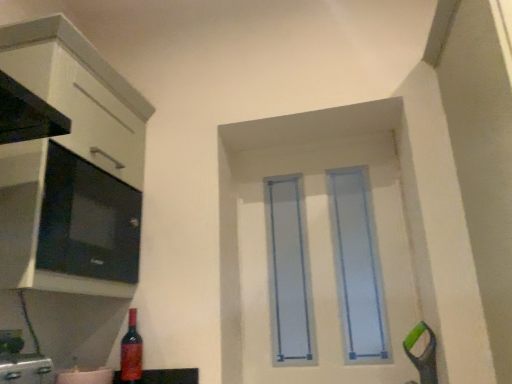
What do you see at coordinates (87, 220) in the screenshot? The image size is (512, 384). I see `matte black microwave at left` at bounding box center [87, 220].

This screenshot has height=384, width=512. Describe the element at coordinates (324, 263) in the screenshot. I see `light blue plastic door at center` at that location.

You are a GUI agent. You are given a task and a screenshot of the screen. Output one action in this format:
    pyautogui.click(x=<x>, y=<y>)
    Task: Click on the matte black microwave at left
    Image resolution: width=512 pixels, height=384 pixels.
    Given the screenshot: What is the action you would take?
    pyautogui.click(x=87, y=220)

Would you consider shiny red glass bottle at lower left to be distant from light blue plastic door at center?

Actually, shiny red glass bottle at lower left and light blue plastic door at center are a little close together.

From the picture: Can we say shiny red glass bottle at lower left lies outside light blue plastic door at center?

Yes, shiny red glass bottle at lower left is located beyond the bounds of light blue plastic door at center.

In the image, is shiny red glass bottle at lower left positioned in front of or behind light blue plastic door at center?

shiny red glass bottle at lower left is positioned closer to the viewer than light blue plastic door at center.

Could you tell me if shiny red glass bottle at lower left is facing light blue plastic door at center?

No, shiny red glass bottle at lower left is not oriented towards light blue plastic door at center.

Which object is closer to the camera, white glossy cabinet at left or light blue plastic door at center?

white glossy cabinet at left is more forward.

This screenshot has width=512, height=384. Identify the location of cabinetry lying above the light blue plastic door at center (from the image's perspective). (71, 168).

Is point (8, 156) positioned after point (370, 156)?

No.

From the image's perspective, does white glossy cabinet at left appear lower than light blue plastic door at center?

No.

Between matte black microwave at left and white glossy cabinet at left, which one has more height?

white glossy cabinet at left is taller.

Locate an element on the screen. This screenshot has width=512, height=384. appliance behind the white glossy cabinet at left is located at coordinates (87, 220).

Can we say matte black microwave at left lies outside white glossy cabinet at left?

Actually, matte black microwave at left is at least partially inside white glossy cabinet at left.

Considering the positions of objects white glossy cabinet at left and shiny red glass bottle at lower left in the image provided, who is in front, white glossy cabinet at left or shiny red glass bottle at lower left?

white glossy cabinet at left is in front.

From a real-world perspective, who is located lower, white glossy cabinet at left or shiny red glass bottle at lower left?

From a 3D spatial view, shiny red glass bottle at lower left is below.

Is white glossy cabinet at left spatially inside shiny red glass bottle at lower left, or outside of it?

white glossy cabinet at left lies outside shiny red glass bottle at lower left.

Is shiny red glass bottle at lower left at the back of white glossy cabinet at left?

white glossy cabinet at left does not have its back to shiny red glass bottle at lower left.

Is shiny red glass bottle at lower left taller or shorter than matte black microwave at left?

shiny red glass bottle at lower left is shorter than matte black microwave at left.

Is shiny red glass bottle at lower left to the left or to the right of matte black microwave at left in the image?

In the image, shiny red glass bottle at lower left appears on the right side of matte black microwave at left.

Is point (138, 379) closer to camera compared to point (135, 253)?

Yes.

Is the position of shiny red glass bottle at lower left more distant than that of matte black microwave at left?

That is True.

Between light blue plastic door at center and white glossy cabinet at left, which one has larger width?

With larger width is white glossy cabinet at left.

Is point (367, 159) behind point (96, 186)?

Yes.

Is light blue plastic door at center not close to white glossy cabinet at left?

That's not correct — light blue plastic door at center is a little close to white glossy cabinet at left.

Can you confirm if light blue plastic door at center is shorter than white glossy cabinet at left?

Incorrect, the height of light blue plastic door at center does not fall short of that of white glossy cabinet at left.

This screenshot has height=384, width=512. Identify the location of appliance that appears above the shiny red glass bottle at lower left (from the image's perspective). (87, 220).

Is matte black microwave at left not near shiny red glass bottle at lower left?

No, matte black microwave at left is not far away from shiny red glass bottle at lower left.

In terms of height, does matte black microwave at left look taller or shorter compared to shiny red glass bottle at lower left?

Clearly, matte black microwave at left is taller compared to shiny red glass bottle at lower left.

From the image's perspective, which one is positioned lower, matte black microwave at left or shiny red glass bottle at lower left?

shiny red glass bottle at lower left, from the image's perspective.

You are a GUI agent. You are given a task and a screenshot of the screen. Output one action in this format:
    pyautogui.click(x=<x>, y=<y>)
    Task: Click on the door above the shiny red glass bottle at lower left (from a real-world perspective)
    Image resolution: width=512 pixels, height=384 pixels.
    Given the screenshot: What is the action you would take?
    pyautogui.click(x=324, y=263)

Identify the location of door directly beneath the white glossy cabinet at left (from a real-world perspective). The height and width of the screenshot is (384, 512). (324, 263).

Considering their positions, is white glossy cabinet at left positioned closer to matte black microwave at left than light blue plastic door at center?

white glossy cabinet at left lies closer to matte black microwave at left than the other object.

Considering their positions, is matte black microwave at left positioned further to shiny red glass bottle at lower left than white glossy cabinet at left?

white glossy cabinet at left is positioned further to the anchor shiny red glass bottle at lower left.

Looking at the image, which one is located further to white glossy cabinet at left, matte black microwave at left or light blue plastic door at center?

The object further to white glossy cabinet at left is light blue plastic door at center.

Based on their spatial positions, is shiny red glass bottle at lower left or white glossy cabinet at left further from matte black microwave at left?

shiny red glass bottle at lower left is further to matte black microwave at left.

When comparing their distances from shiny red glass bottle at lower left, does matte black microwave at left or light blue plastic door at center seem closer?

The object closer to shiny red glass bottle at lower left is matte black microwave at left.

Estimate the real-world distances between objects in this image. Which object is further from white glossy cabinet at left, light blue plastic door at center or matte black microwave at left?

light blue plastic door at center is positioned further to the anchor white glossy cabinet at left.

From the image, which object appears to be nearer to white glossy cabinet at left, matte black microwave at left or shiny red glass bottle at lower left?

Among the two, matte black microwave at left is located nearer to white glossy cabinet at left.

From the image, which object appears to be farther from light blue plastic door at center, white glossy cabinet at left or matte black microwave at left?

The object further to light blue plastic door at center is white glossy cabinet at left.

I want to click on cabinetry between matte black microwave at left and light blue plastic door at center, so click(x=71, y=168).

Locate an element on the screen. The image size is (512, 384). appliance that lies between white glossy cabinet at left and shiny red glass bottle at lower left from top to bottom is located at coordinates [x=87, y=220].

I want to click on bottle between matte black microwave at left and light blue plastic door at center, so click(131, 352).

The height and width of the screenshot is (384, 512). I want to click on bottle between white glossy cabinet at left and light blue plastic door at center in the horizontal direction, so click(x=131, y=352).